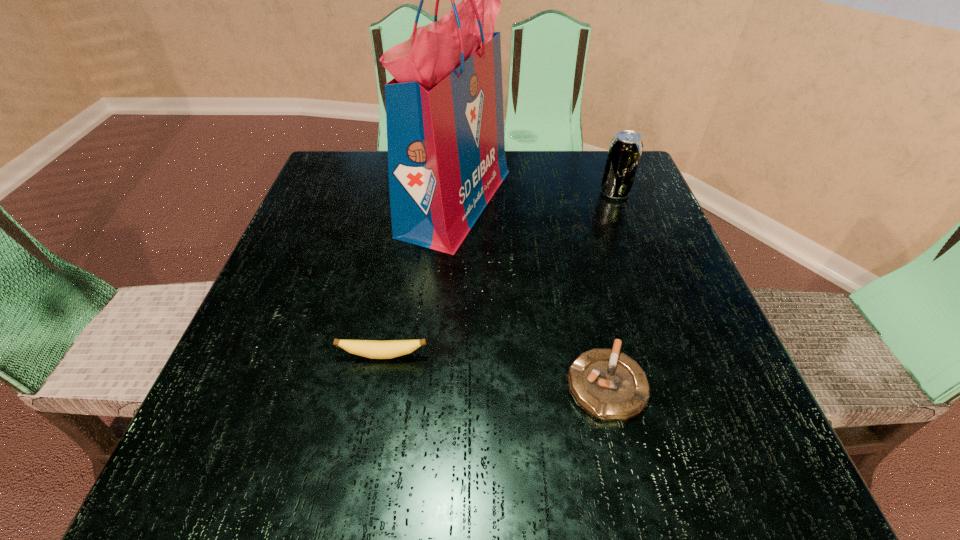
Identify the location of free spot at the far left corner of the desktop. (328, 155).

The width and height of the screenshot is (960, 540). I want to click on blank region between the third tallest object and the soda can, so click(x=499, y=274).

Where is `unoccupied position between the banana and the rightmost object`? This screenshot has width=960, height=540. unoccupied position between the banana and the rightmost object is located at coordinates (499, 274).

Where is `vacant area that lies between the tallest object and the second tallest object`? The width and height of the screenshot is (960, 540). vacant area that lies between the tallest object and the second tallest object is located at coordinates (536, 198).

Identify the location of free space between the tallest object and the soda can. (536, 198).

Locate an element on the screen. empty space that is in between the tallest object and the third object from left to right is located at coordinates (531, 293).

In order to click on free spot between the grocery bag and the banana in this screenshot , I will do `click(420, 279)`.

Find the location of a particular element. The image size is (960, 540). vacant space that is in between the second shortest object and the second object from right to left is located at coordinates (494, 370).

Locate an element on the screen. unoccupied position between the grocery bag and the second tallest object is located at coordinates (536, 198).

Where is `vacant area that lies between the banana and the rightmost object`? This screenshot has height=540, width=960. vacant area that lies between the banana and the rightmost object is located at coordinates (499, 274).